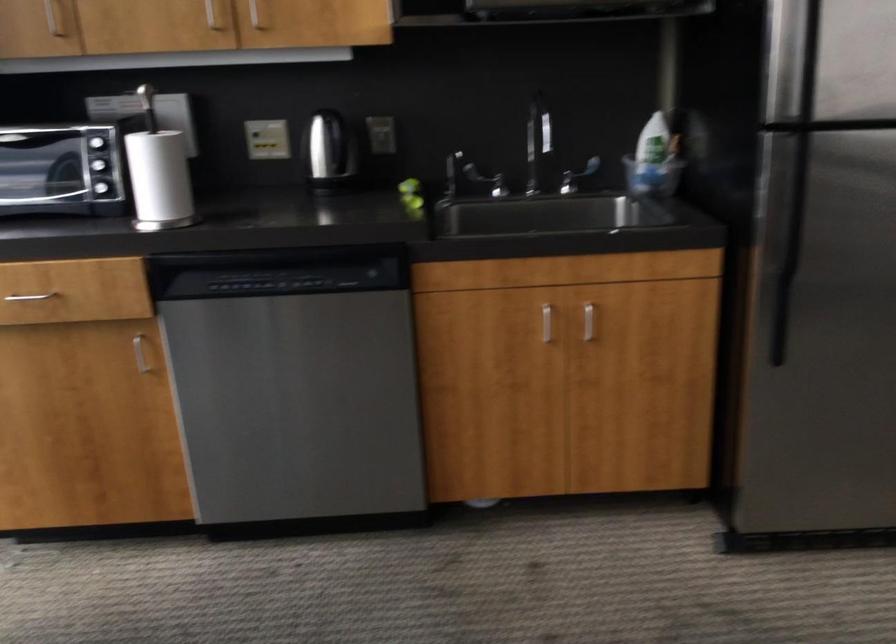
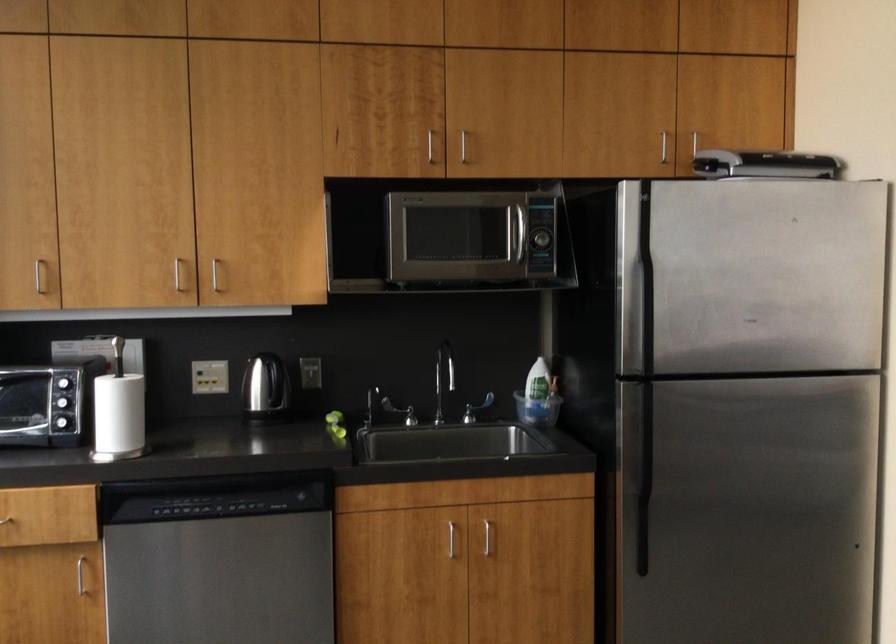
The point at (263, 243) is marked in the first image. Where is the corresponding point in the second image?

(208, 471)